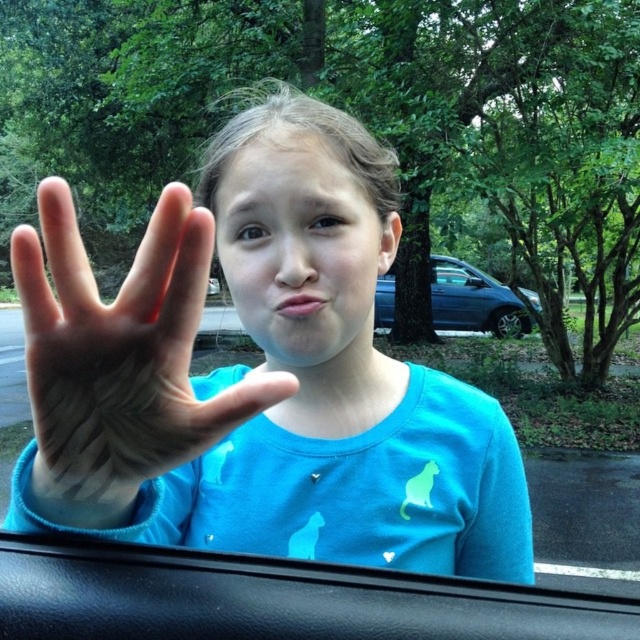
Is matte blue shirt at center wider than matte skin hand at center?

Yes, matte blue shirt at center is wider than matte skin hand at center.

Between point (52, 488) and point (164, 243), which one is positioned in front?

Point (164, 243) is in front.

Which is in front, point (326, 433) or point (198, 401)?

Point (198, 401)

Where is `matte blue shirt at center`? Image resolution: width=640 pixels, height=640 pixels. matte blue shirt at center is located at coordinates (259, 372).

Is matte skin hand at center wider than blue metallic car at center?

No.

Between point (72, 282) and point (490, 292), which one is positioned behind?

The point (490, 292) is behind.

Identify the location of matte skin hand at center. (120, 355).

Can you confirm if matte skin hand at center is smaller than black leather car door at lower center?

No.

Can you confirm if matte skin hand at center is positioned to the left of black leather car door at lower center?

Yes, matte skin hand at center is to the left of black leather car door at lower center.

Is point (108, 449) farther from camera compared to point (6, 554)?

No, (108, 449) is in front of (6, 554).

This screenshot has width=640, height=640. What are the coordinates of `matte skin hand at center` in the screenshot? It's located at [x=120, y=355].